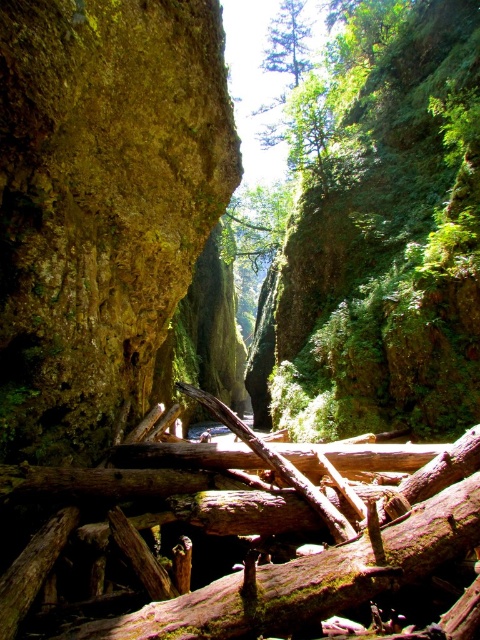
Question: Which object is positioned farthest from the green matte tree at upper center?

Choices:
 (A) brown rough wood at center
 (B) rusty metallic rock at left

Answer: (A)

Question: Estimate the real-world distances between objects in this image. Which object is farther from the brown rough wood at center?

Choices:
 (A) green matte tree at upper center
 (B) rusty metallic rock at left

Answer: (A)

Question: Does rusty metallic rock at left appear over brown rough wood at center?

Choices:
 (A) no
 (B) yes

Answer: (B)

Question: Is rusty metallic rock at left above brown rough wood at center?

Choices:
 (A) yes
 (B) no

Answer: (A)

Question: Which of the following is the farthest from the observer?

Choices:
 (A) (469, 497)
 (B) (266, 45)
 (C) (94, 99)

Answer: (B)

Question: Is brown rough wood at center closer to the viewer compared to green matte tree at upper center?

Choices:
 (A) no
 (B) yes

Answer: (B)